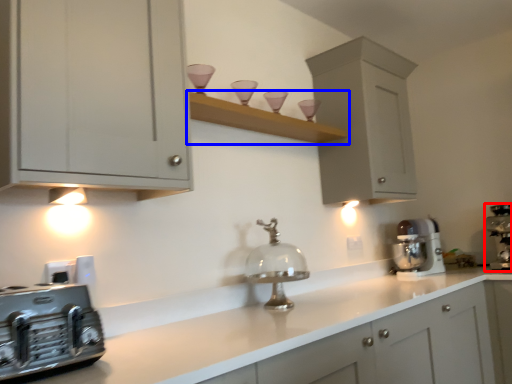
Question: Which object is further to the camera taking this photo, home appliance (highlighted by a red box) or shelf (highlighted by a blue box)?

Choices:
 (A) home appliance
 (B) shelf

Answer: (A)